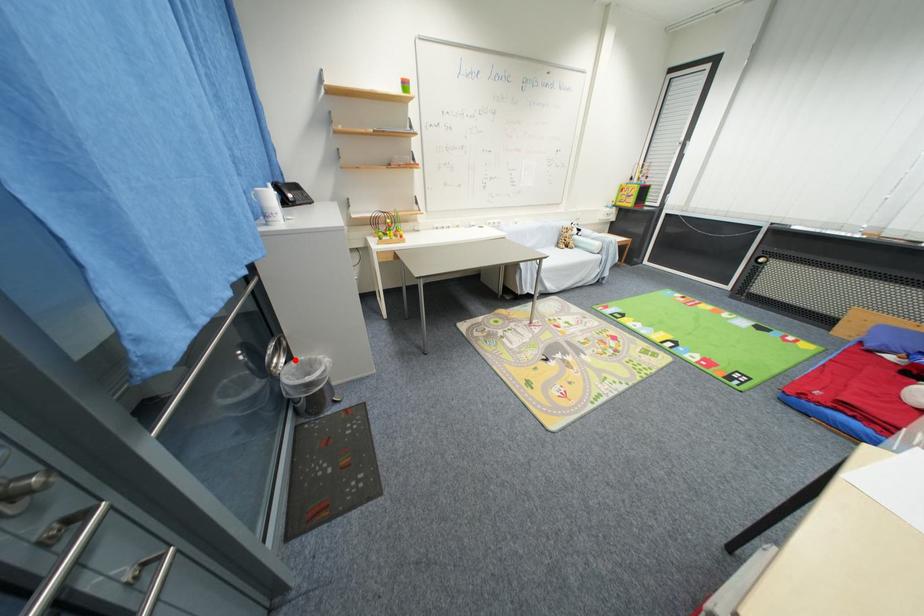
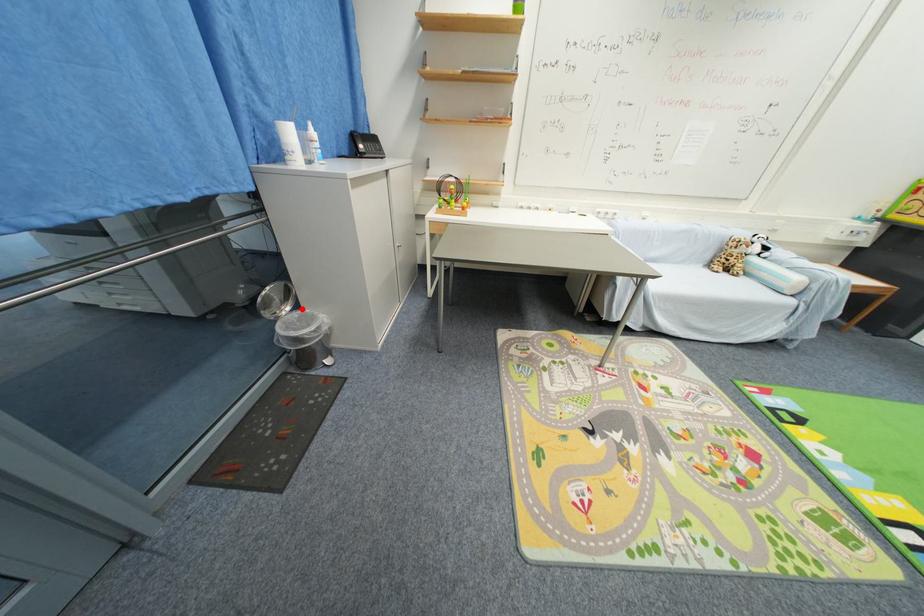
I am providing you with two images of the same scene from different viewpoints. A red point is marked on the first image and another point is marked on the second image. Does the point marked in image1 correspond to the same location as the one in image2?

Yes